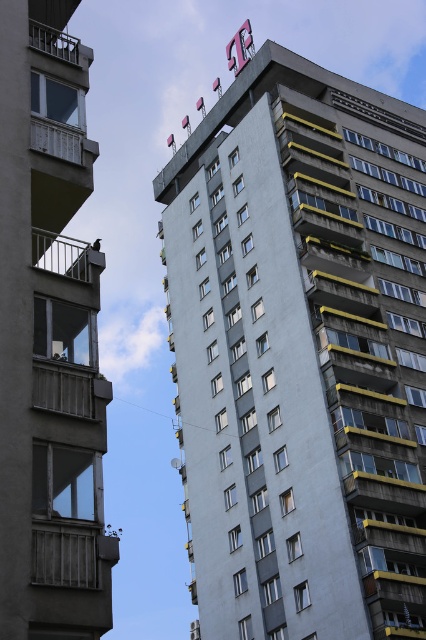
You are standing at the base of the left building and want to place a 10 feet long ladder between the metallic railing at left and the white painted wood balcony at left. Will the ladder fit between them without bending?

The metallic railing at left is 10.89 feet from white painted wood balcony at left. Since the ladder is 10 feet long, which is shorter than the distance between them, the ladder will fit between them without bending.

You are an architect evaluating the structural integrity of the two balconies on the left building. Based on the height difference between the concrete balcony at left and the metallic gray balcony at left, which one might require additional support due to its height?

The concrete balcony at left has a greater height compared to the metallic gray balcony at left, so it might require additional support due to its height.